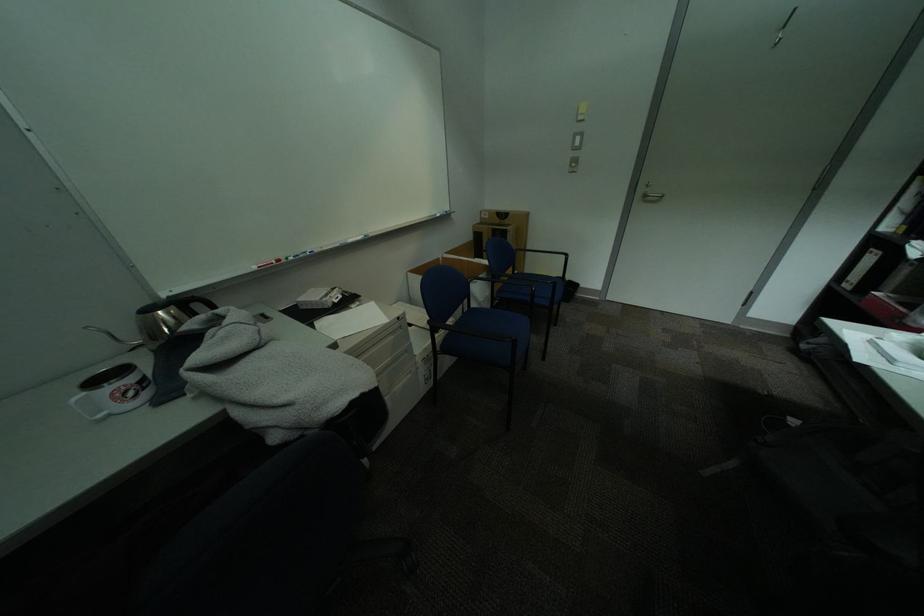
Where would you pull the binder finger hole? Please return your answer as a coordinate pair (x, y).

(860, 268)